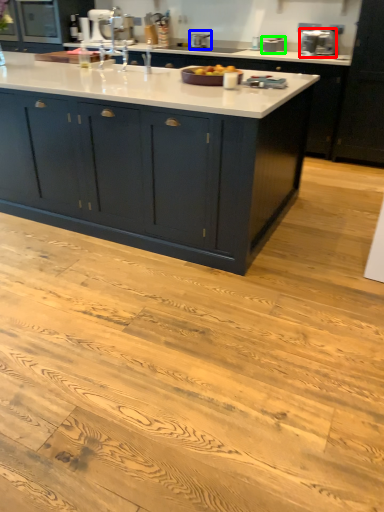
Question: Based on their relative distances, which object is farther from appliance (highlighted by a red box)? Choose from appliance (highlighted by a blue box) and appliance (highlighted by a green box).

Choices:
 (A) appliance
 (B) appliance

Answer: (A)